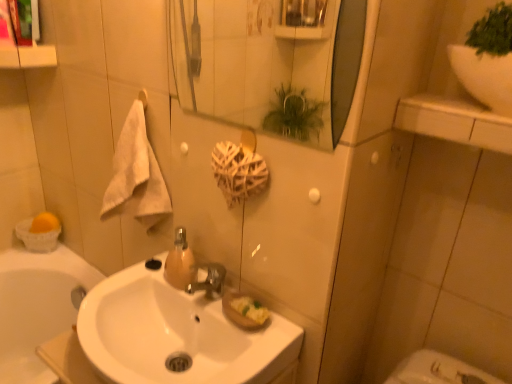
The height and width of the screenshot is (384, 512). Find the location of `free space above white glossy sink at upper right (from a real-world perspective)`. free space above white glossy sink at upper right (from a real-world perspective) is located at coordinates coord(465,107).